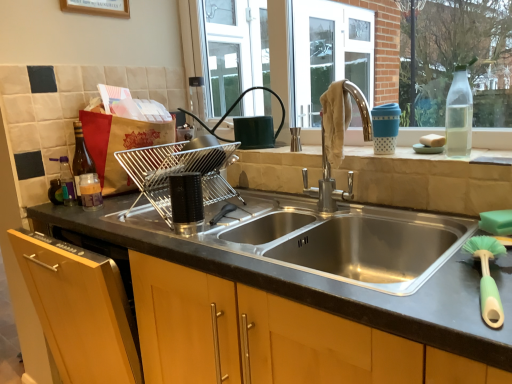
I want to click on spots to the right of metallic silver dish rack at sink, the 2th appliance positioned from the front, so click(x=250, y=209).